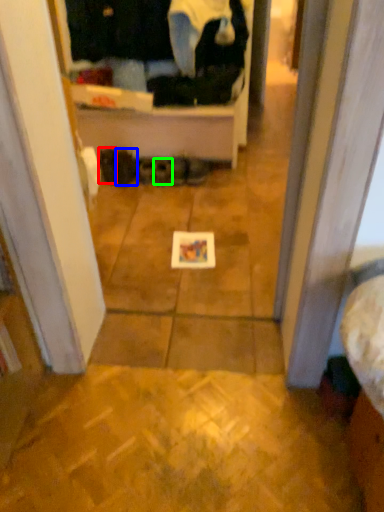
Question: Estimate the real-world distances between objects in this image. Which object is closer to footwear (highlighted by a red box), footwear (highlighted by a blue box) or footwear (highlighted by a green box)?

Choices:
 (A) footwear
 (B) footwear

Answer: (A)